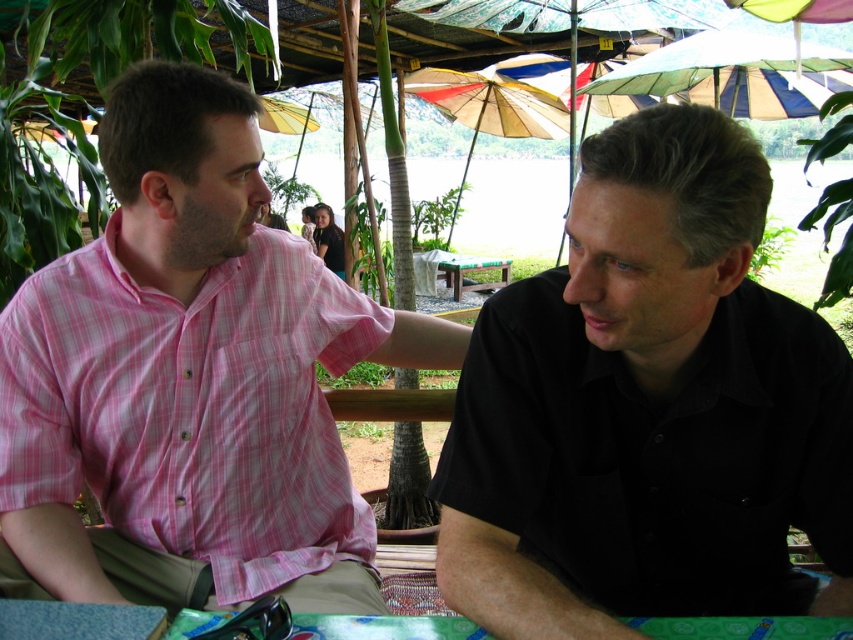
Can you confirm if blue and white striped umbrella at upper center is positioned below multi-colored paper umbrella at center?

Yes, blue and white striped umbrella at upper center is below multi-colored paper umbrella at center.

Does blue and white striped umbrella at upper center appear on the right side of multi-colored paper umbrella at center?

Correct, you'll find blue and white striped umbrella at upper center to the right of multi-colored paper umbrella at center.

Does point (587, 84) lie in front of point (450, 115)?

Yes, point (587, 84) is in front of point (450, 115).

Locate an element on the screen. The width and height of the screenshot is (853, 640). blue and white striped umbrella at upper center is located at coordinates (730, 76).

Does black matte shirt at right have a smaller size compared to blue and white striped umbrella at upper center?

Correct, black matte shirt at right occupies less space than blue and white striped umbrella at upper center.

Is black matte shirt at right taller than blue and white striped umbrella at upper center?

Yes, black matte shirt at right is taller than blue and white striped umbrella at upper center.

Describe the element at coordinates (647, 408) in the screenshot. The width and height of the screenshot is (853, 640). I see `black matte shirt at right` at that location.

Where is `black matte shirt at right`? black matte shirt at right is located at coordinates (647, 408).

Between black matte shirt at right and wooden table at center, which one appears on the right side from the viewer's perspective?

wooden table at center is more to the right.

Can you confirm if black matte shirt at right is positioned to the right of wooden table at center?

No, black matte shirt at right is not to the right of wooden table at center.

Who is more distant from viewer, (654,212) or (456,300)?

The point (456,300) is more distant.

Where is `black matte shirt at right`? This screenshot has width=853, height=640. black matte shirt at right is located at coordinates (647, 408).